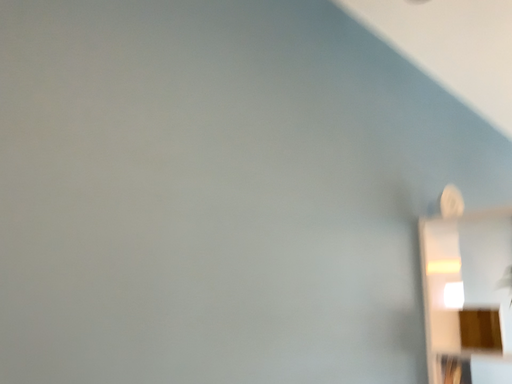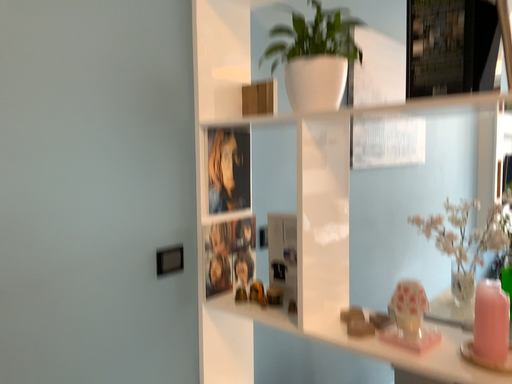
Question: How did the camera likely rotate when shooting the video?

Choices:
 (A) rotated downward
 (B) rotated upward

Answer: (A)